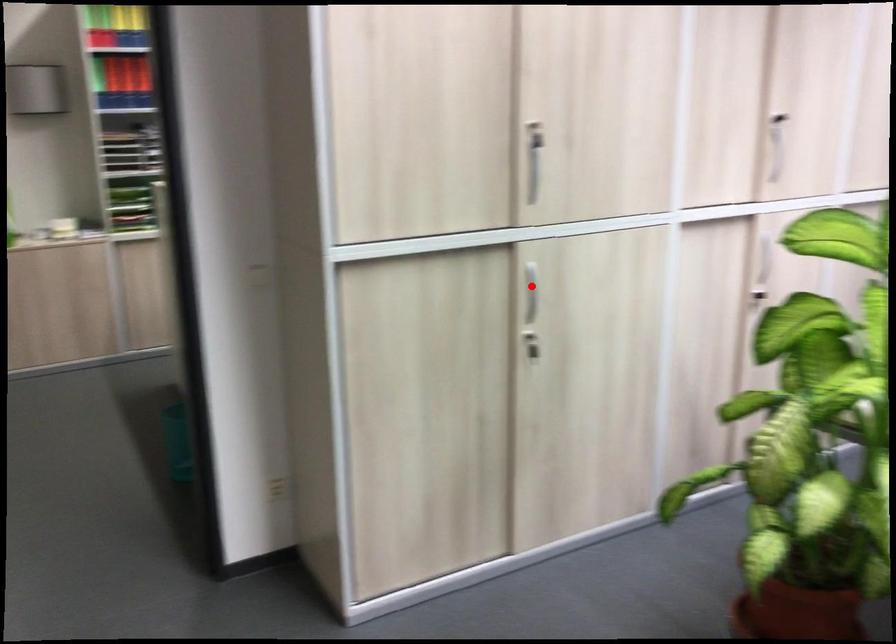
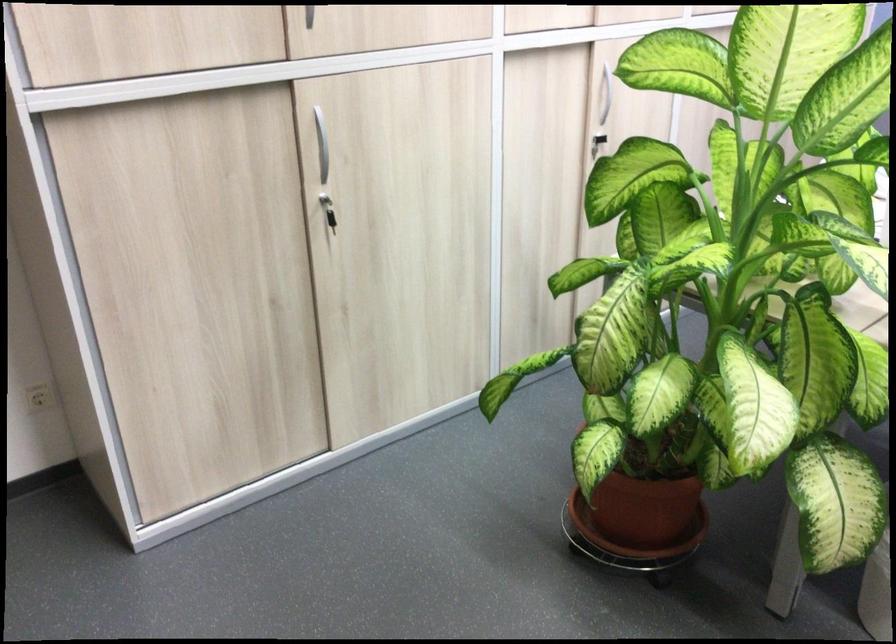
Locate, in the second image, the point that corresponds to the highlighted location in the first image.

(321, 140)